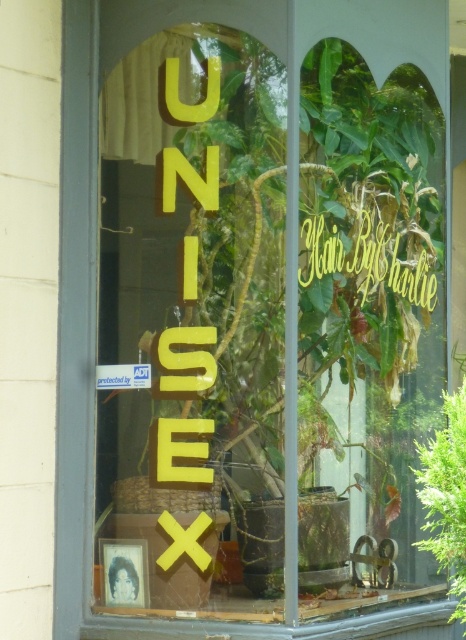
Question: Which of the following is the farthest from the observer?

Choices:
 (A) green leafy plant at right
 (B) yellow metallic sign at center

Answer: (B)

Question: Is green leafy plant at right bigger than yellow metallic sign at center?

Choices:
 (A) no
 (B) yes

Answer: (B)

Question: Which point appears farthest from the camera in this image?

Choices:
 (A) coord(456,566)
 (B) coord(301,284)

Answer: (A)

Question: Is green leafy plant at right positioned before yellow metallic sign at center?

Choices:
 (A) yes
 (B) no

Answer: (A)

Question: In this image, where is green leafy plant at right located relative to yellow metallic sign at center?

Choices:
 (A) above
 (B) below

Answer: (B)

Question: Which point is farther to the camera?

Choices:
 (A) (354, 262)
 (B) (434, 448)

Answer: (A)